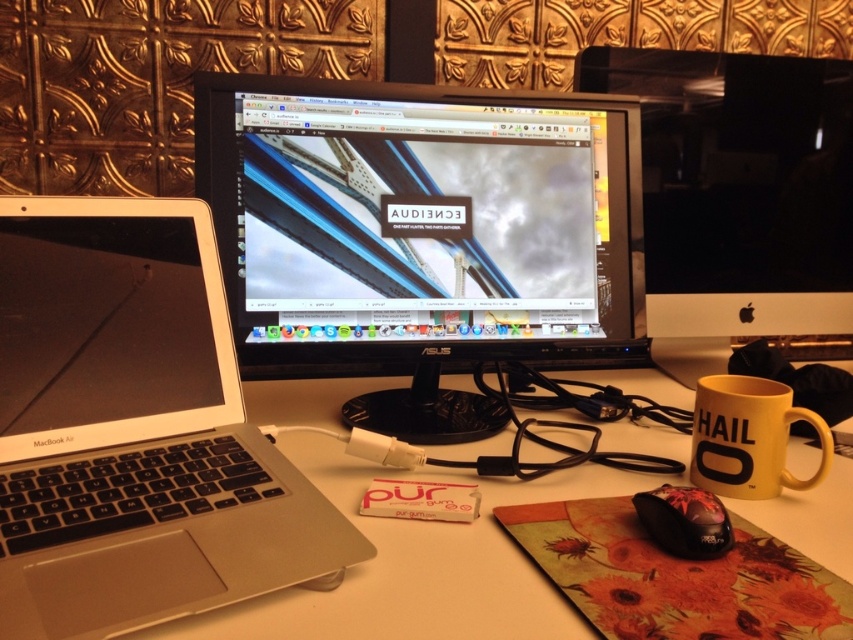
You are setting up a new monitor stand that requires the monitor to be placed below the laptop. Can you place the black plastic monitor at center below the satin black laptop at left based on the current arrangement?

The black plastic monitor at center is currently above the satin black laptop at left, so you cannot place it below as required by the stand.

You are organizing items on a white plastic computer desk at center. You need to place a new item at the exact location of point (416, 564). Is this point located on the desk?

Yes, the point (416, 564) is on the white plastic computer desk at center, so placing the new item there is possible.